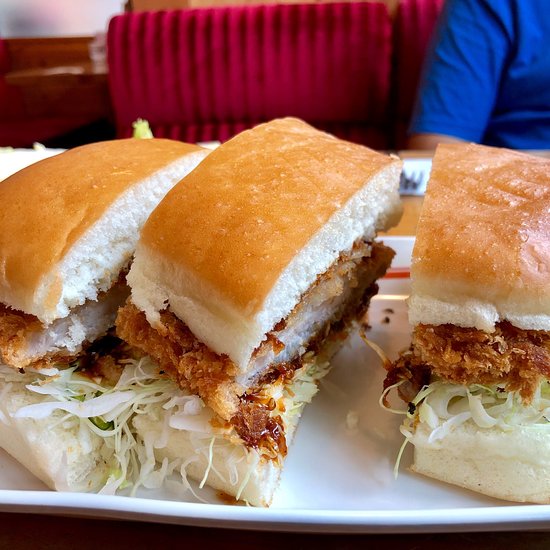
This screenshot has height=550, width=550. Find the location of `napkin`. napkin is located at coordinates (418, 167).